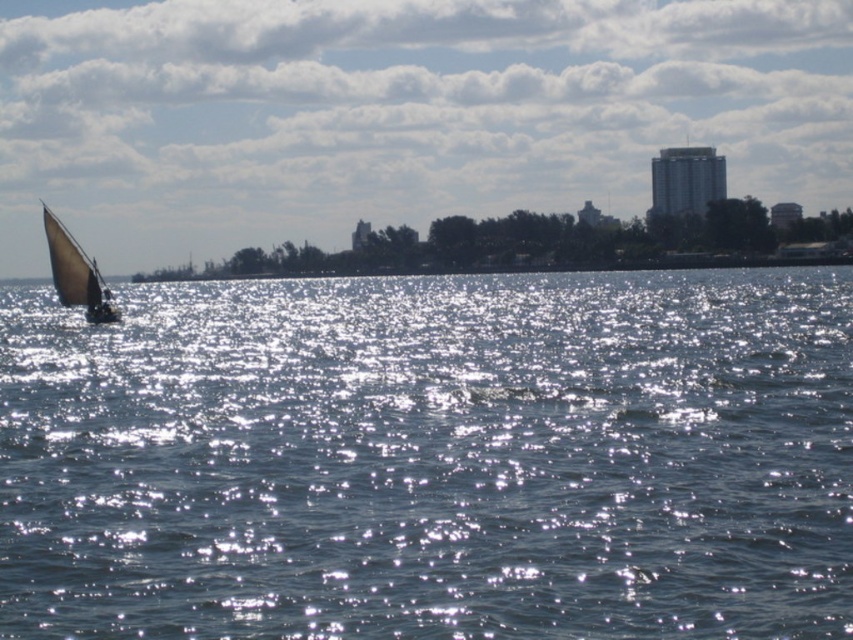
Can you confirm if matte white sailboat at left is bigger than white canvas sail at left?

Indeed, matte white sailboat at left has a larger size compared to white canvas sail at left.

What do you see at coordinates (396, 113) in the screenshot? This screenshot has width=853, height=640. I see `matte white sailboat at left` at bounding box center [396, 113].

The image size is (853, 640). I want to click on matte white sailboat at left, so click(x=396, y=113).

Which is behind, point (729, 532) or point (70, 291)?

Point (70, 291)

Is blue water at left positioned at the back of white canvas sail at left?

No.

Between point (206, 474) and point (102, 310), which one is positioned in front?

Positioned in front is point (206, 474).

Find the location of a particular element. The image size is (853, 640). blue water at left is located at coordinates (432, 458).

Can you confirm if blue water at left is smaller than matte white sailboat at left?

Indeed, blue water at left has a smaller size compared to matte white sailboat at left.

Is the position of blue water at left less distant than that of matte white sailboat at left?

Yes, blue water at left is in front of matte white sailboat at left.

The width and height of the screenshot is (853, 640). What are the coordinates of `blue water at left` in the screenshot? It's located at (432, 458).

This screenshot has width=853, height=640. In order to click on blue water at left in this screenshot , I will do `click(432, 458)`.